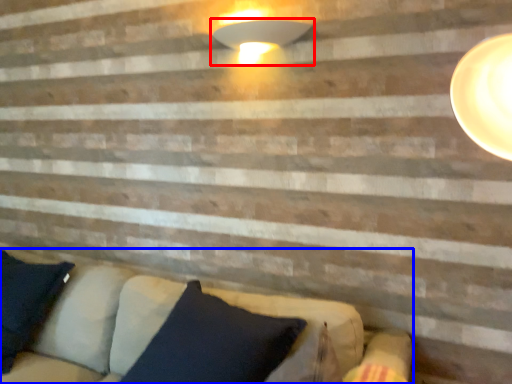
Question: Which object appears closest to the camera in this image, lamp (highlighted by a red box) or studio couch (highlighted by a blue box)?

Choices:
 (A) lamp
 (B) studio couch

Answer: (B)